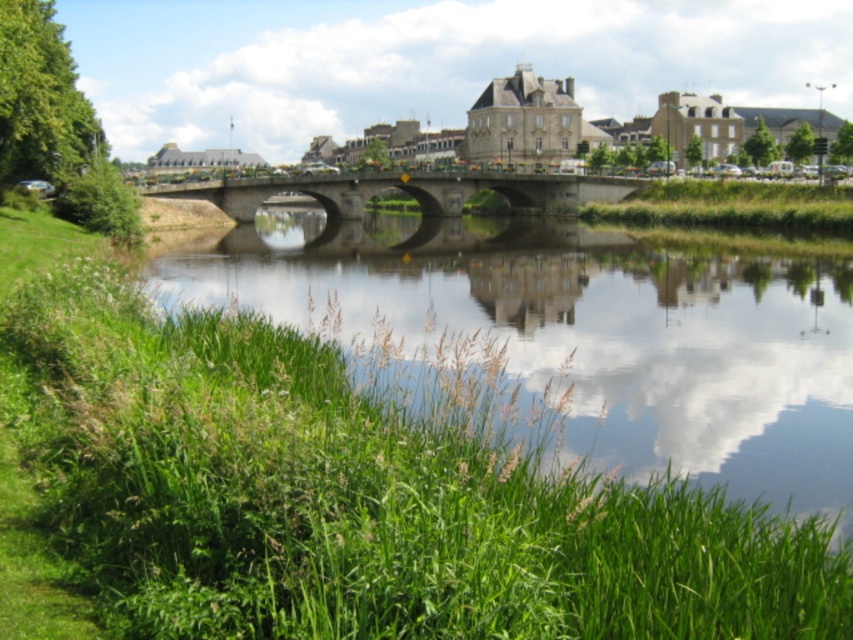
Can you confirm if green grassy river at lower center is positioned to the left of concrete bridge at center?

No, green grassy river at lower center is not to the left of concrete bridge at center.

Describe the element at coordinates (581, 332) in the screenshot. I see `green grassy river at lower center` at that location.

Between point (628, 468) and point (621, 196), which one is positioned in front?

Point (628, 468) is in front.

Locate an element on the screen. green grassy river at lower center is located at coordinates (581, 332).